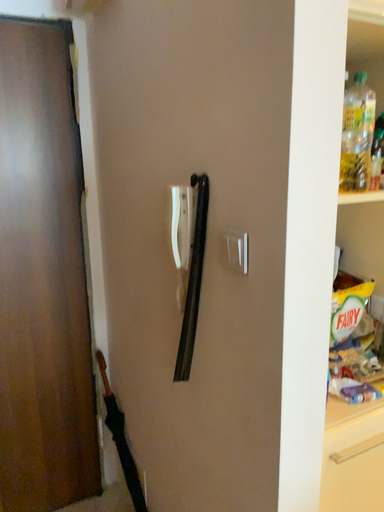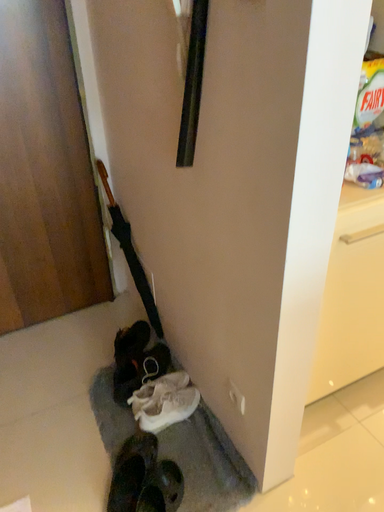
Question: How did the camera likely rotate when shooting the video?

Choices:
 (A) rotated upward
 (B) rotated downward

Answer: (B)